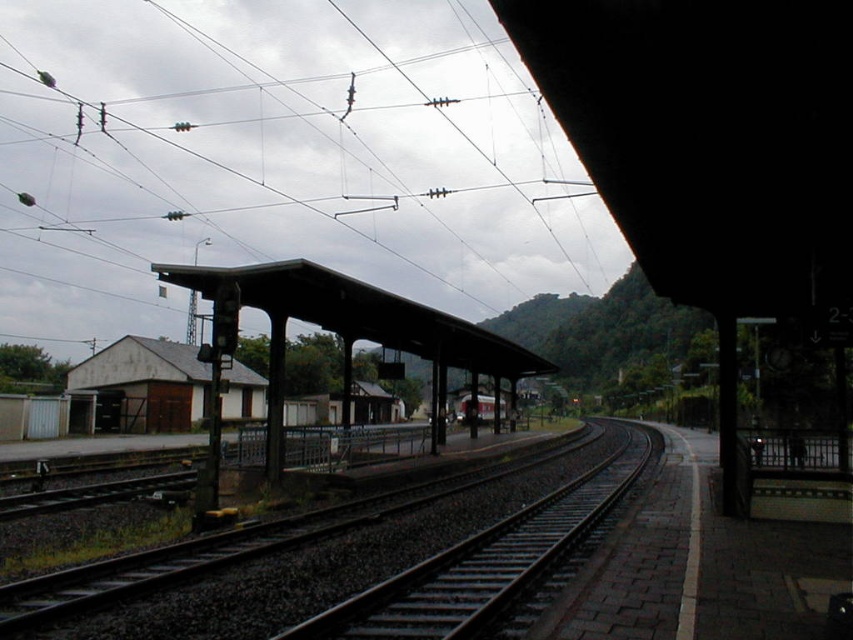
Question: Can you confirm if dark gray metal platform at center is smaller than smooth metal train track at center?

Choices:
 (A) yes
 (B) no

Answer: (B)

Question: Which object is the closest to the metallic wires at upper center?

Choices:
 (A) smooth metal train track at center
 (B) red painted metal train at center
 (C) dark gray metal platform at center

Answer: (B)

Question: Which point is farther to the camera?

Choices:
 (A) (392, 317)
 (B) (503, 406)
 (C) (395, 64)

Answer: (C)

Question: Is dark gray metal platform at center above smooth metal train track at center?

Choices:
 (A) no
 (B) yes

Answer: (B)

Question: Which point is farther to the camera?

Choices:
 (A) (483, 579)
 (B) (479, 403)

Answer: (B)

Question: Does smooth metal train track at center appear on the right side of red painted metal train at center?

Choices:
 (A) no
 (B) yes

Answer: (B)